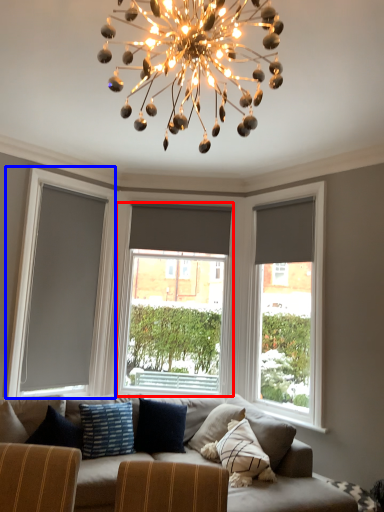
Question: Which object is further to the camera taking this photo, window (highlighted by a red box) or window screen (highlighted by a blue box)?

Choices:
 (A) window
 (B) window screen

Answer: (A)